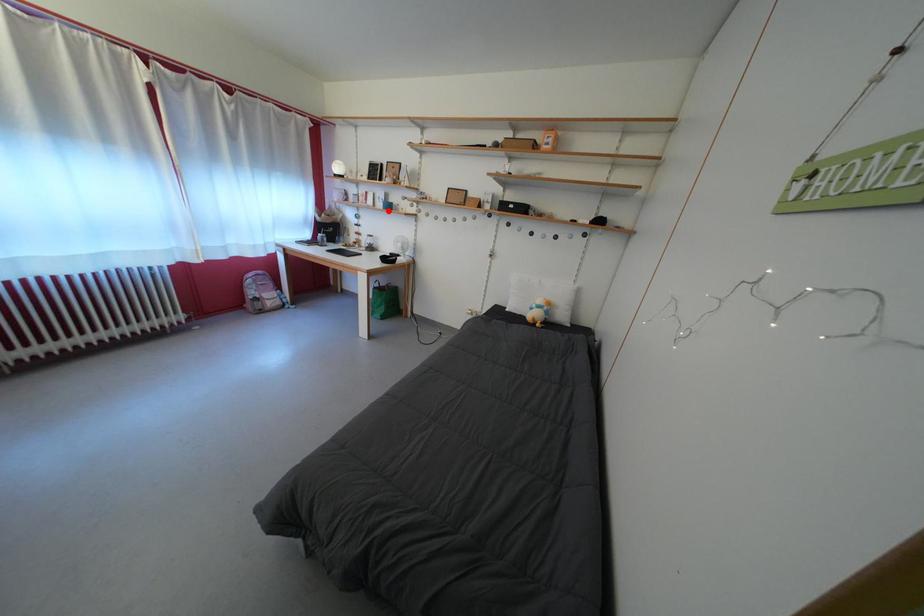
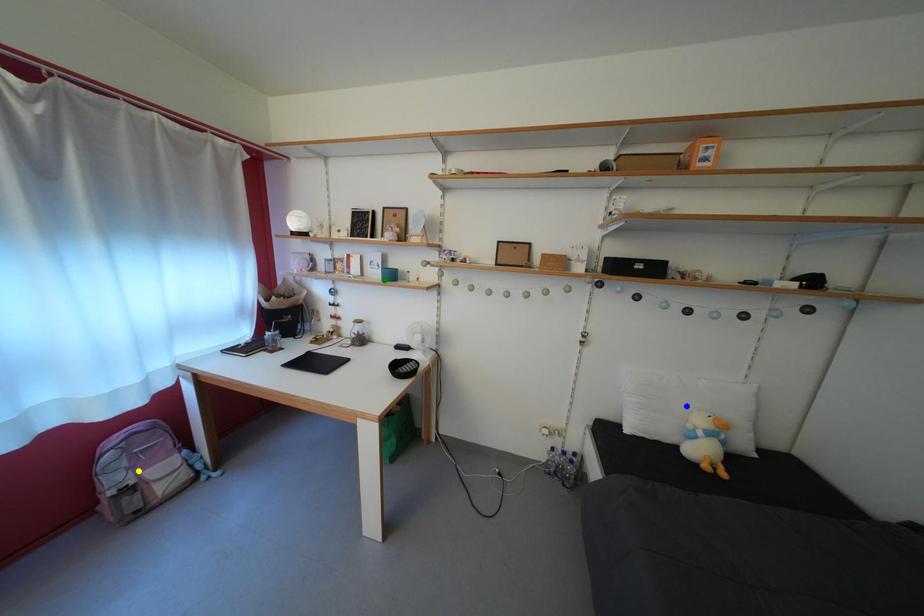
Question: I am providing you with two images of the same scene from different viewpoints. A red point is marked on the first image. You are given multiple points on the second image. In image 2, which mark is for the same physical point as the one in image 1?

Choices:
 (A) blue point
 (B) yellow point
 (C) green point

Answer: (C)